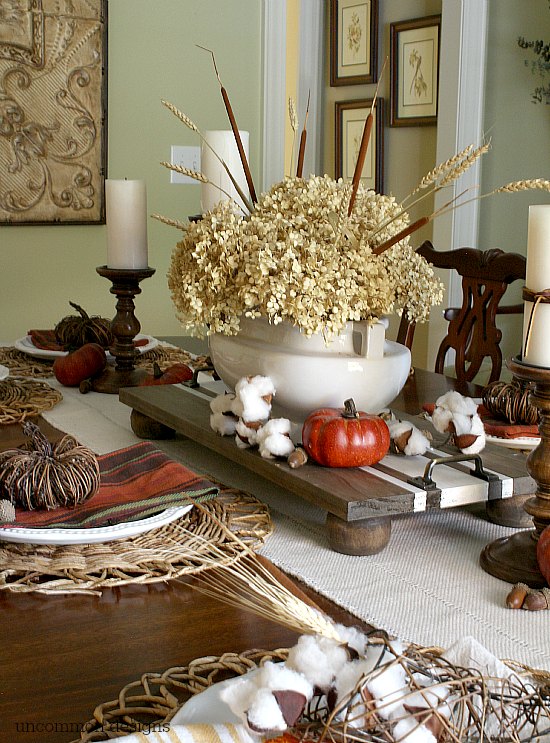
At what (x,y) coordinates should I click in order to perform the action: click on wood table. Please return your answer as a coordinate pair (x, y). Image resolution: width=550 pixels, height=743 pixels. Looking at the image, I should click on tap(198, 625).